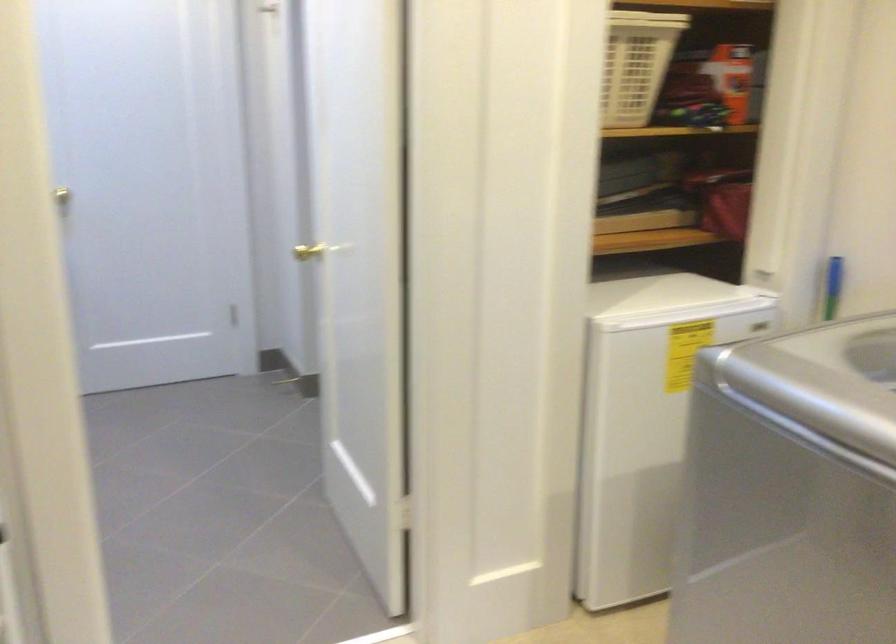
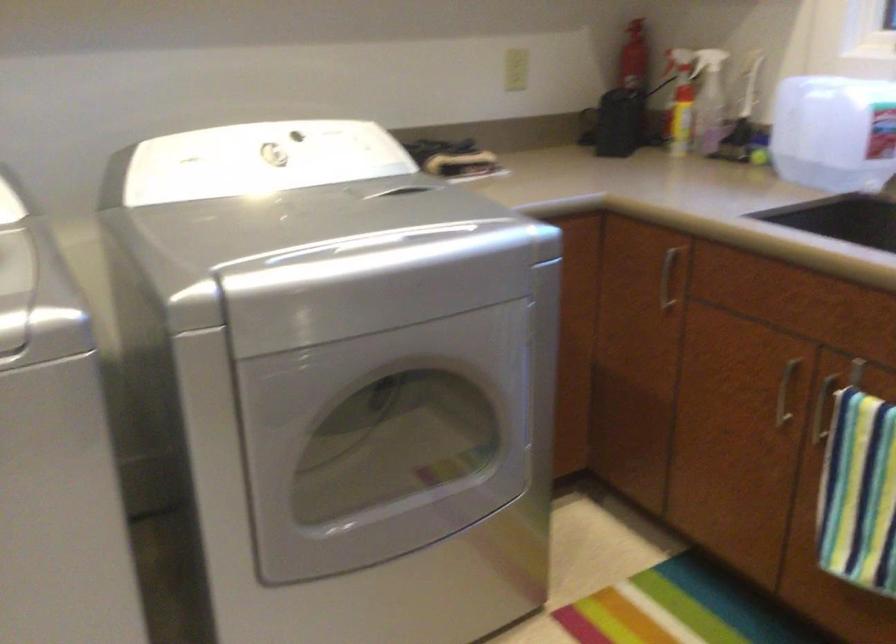
How did the camera likely rotate?

The rotation direction of the camera is right-down.